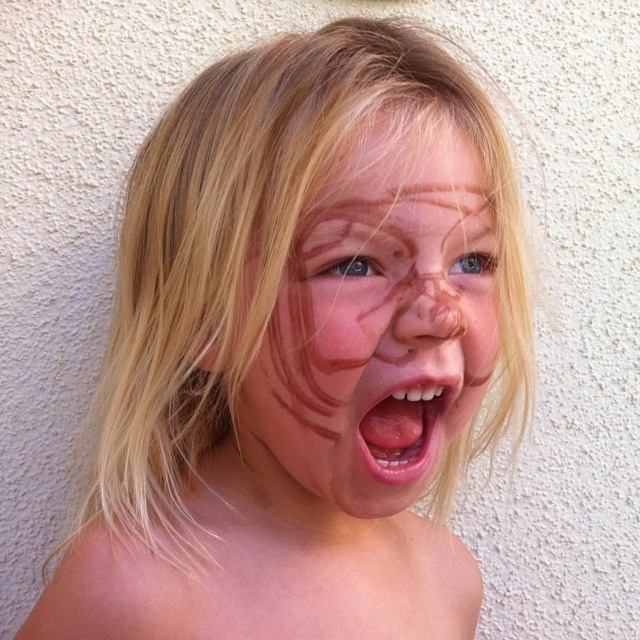
Question: Among these points, which one is nearest to the camera?

Choices:
 (A) (467, 253)
 (B) (364, 148)

Answer: (B)

Question: Which object appears closest to the camera in this image?

Choices:
 (A) smooth blonde hair at upper center
 (B) brown matte eye at center

Answer: (A)

Question: Is smooth blonde hair at upper center positioned behind pink glossy lips at center?

Choices:
 (A) no
 (B) yes

Answer: (A)

Question: Which object is farther from the camera taking this photo?

Choices:
 (A) pink glossy lips at center
 (B) brown matte eye at center
 (C) chocolate matte face at center

Answer: (A)

Question: Considering the relative positions of chocolate matte face at center and blue matte eye at center in the image provided, where is chocolate matte face at center located with respect to blue matte eye at center?

Choices:
 (A) above
 (B) below

Answer: (B)

Question: Is smooth blonde hair at upper center to the right of blue matte eye at center from the viewer's perspective?

Choices:
 (A) no
 (B) yes

Answer: (A)